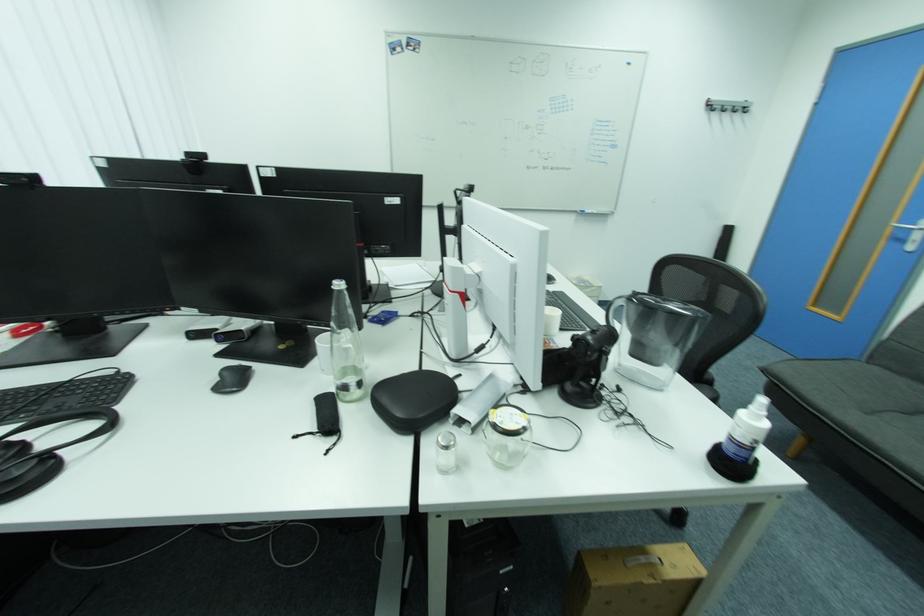
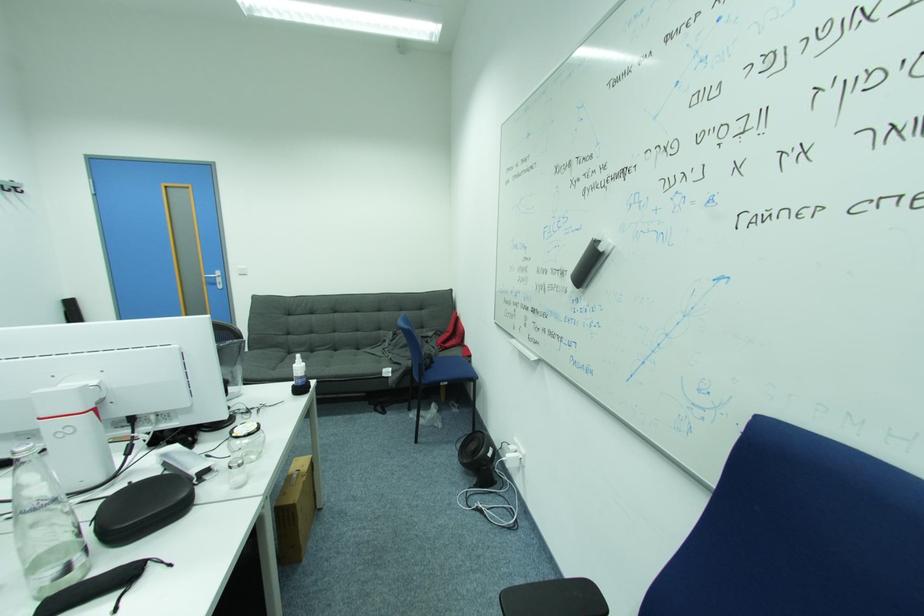
Where in the second image is the point corresponding to (467,377) from the first image?

(138, 484)